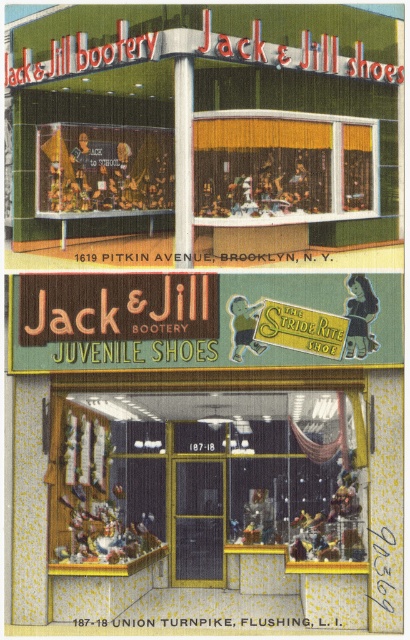
Does wooden display case at center have a greater width compared to green fabric signboard at center?

Yes, wooden display case at center is wider than green fabric signboard at center.

In the scene shown: Between wooden display case at center and green fabric signboard at center, which one appears on the left side from the viewer's perspective?

Positioned to the left is green fabric signboard at center.

This screenshot has width=410, height=640. Identify the location of wooden display case at center. (205, 481).